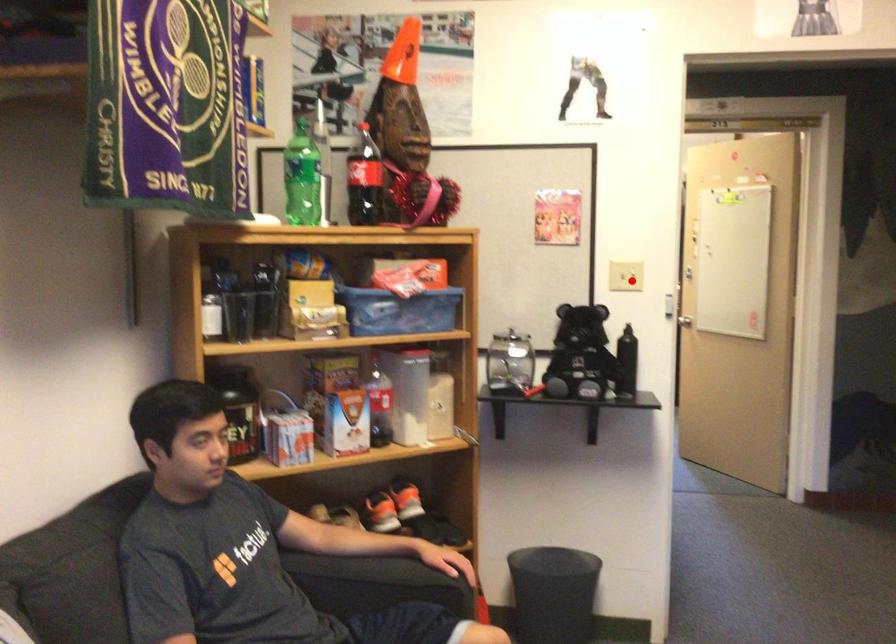
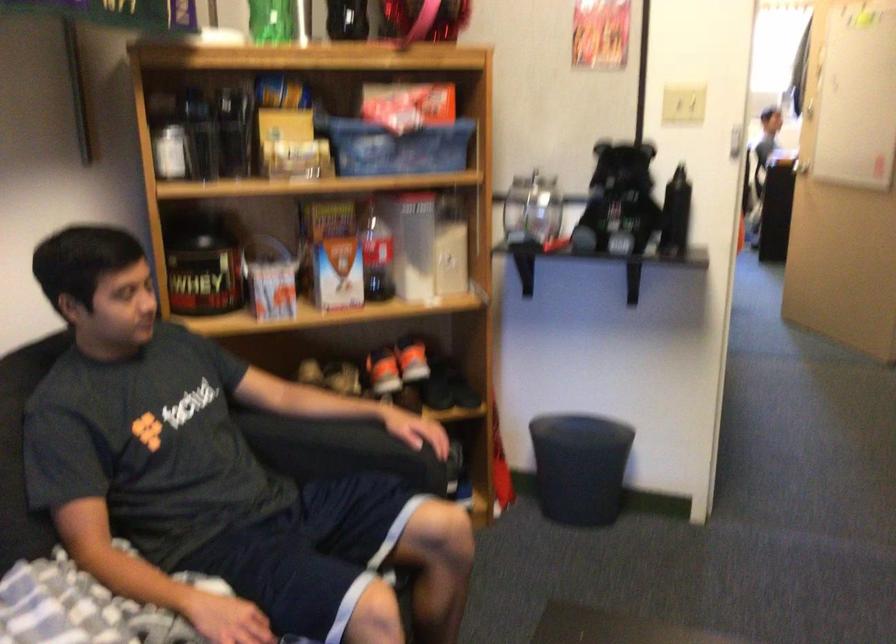
Find the pixel in the second image that matches the highlighted location in the first image.

(682, 106)